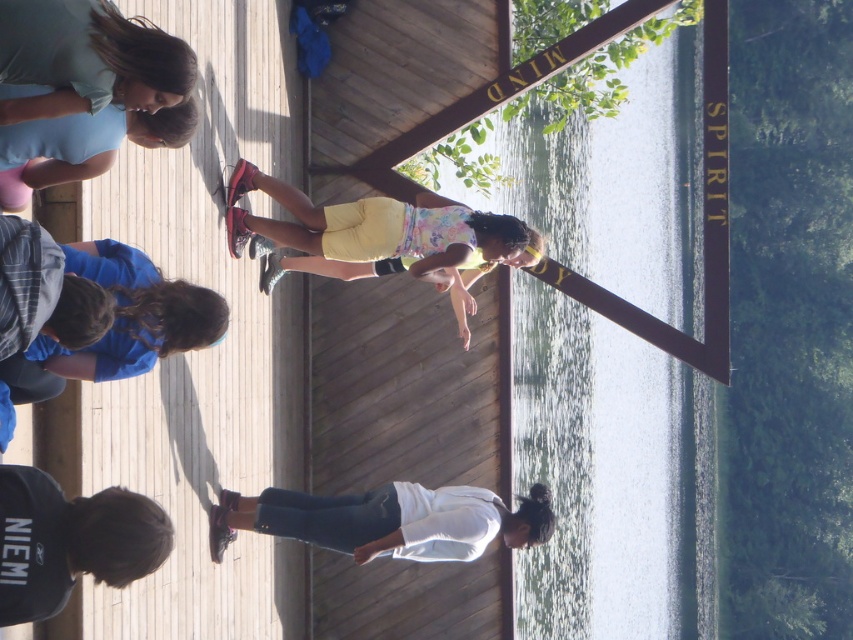
Does yellow cotton shorts at center appear on the right side of white matte shirt at lower center?

In fact, yellow cotton shorts at center is to the left of white matte shirt at lower center.

Consider the image. Who is more distant from viewer, (485, 257) or (379, 502)?

Point (485, 257)

Image resolution: width=853 pixels, height=640 pixels. I want to click on yellow cotton shorts at center, so click(378, 236).

Is black cotton hoodie at lower left wider than matte blue tank top at upper left?

Yes, black cotton hoodie at lower left is wider than matte blue tank top at upper left.

Is the position of black cotton hoodie at lower left less distant than that of matte blue tank top at upper left?

Yes, it is in front of matte blue tank top at upper left.

Between point (134, 525) and point (126, 122), which one is positioned in front?

Point (134, 525)

Find the location of a particular element. black cotton hoodie at lower left is located at coordinates (70, 541).

Can you confirm if matte blue shirt at upper left is bigger than matte blue tank top at upper left?

Yes.

Is point (74, 83) positioned in front of point (78, 170)?

Yes, point (74, 83) is closer to viewer.

Is point (91, 29) positioned before point (103, 152)?

Yes, it is in front of point (103, 152).

Locate an element on the screen. matte blue shirt at upper left is located at coordinates (86, 60).